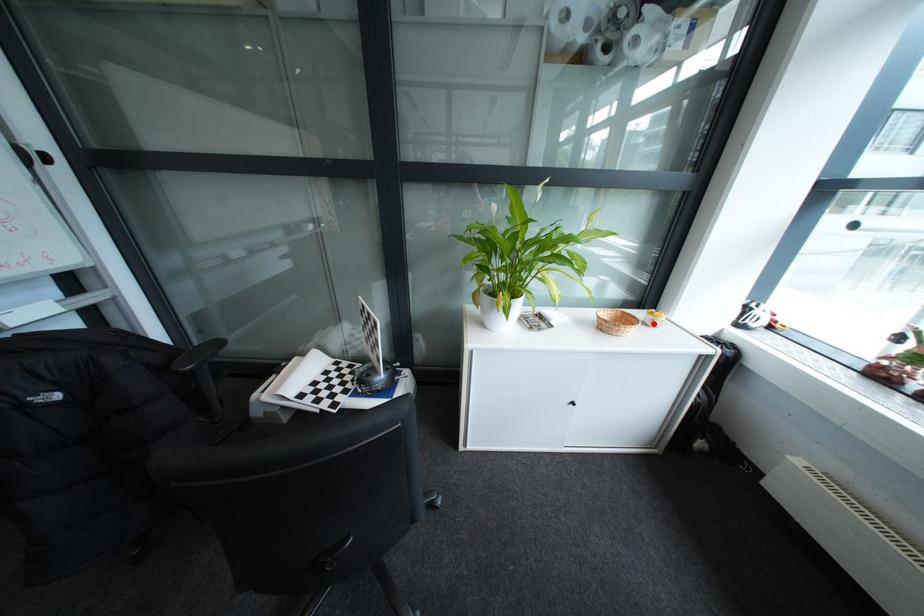
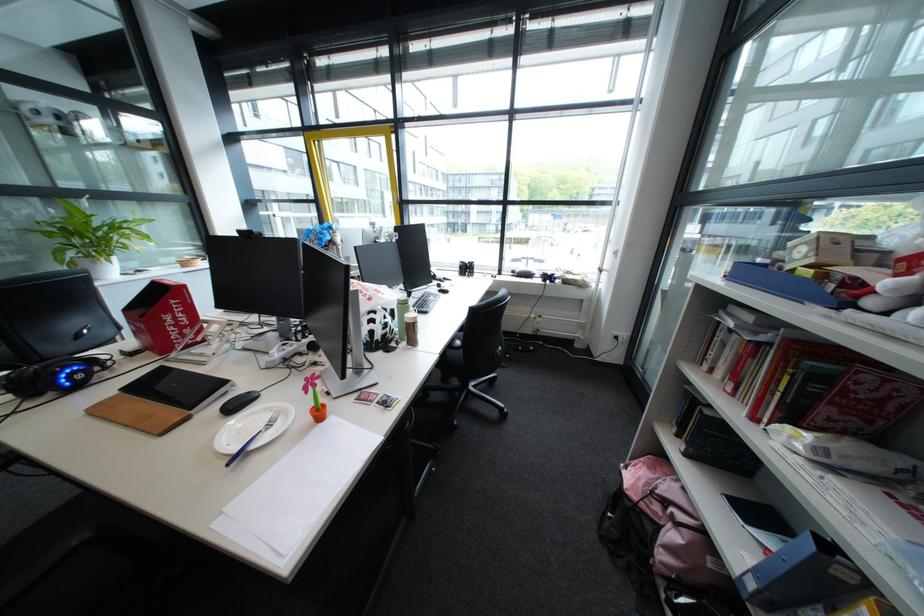
Question: I am providing you with two images of the same scene from different viewpoints. A red point is marked on the first image. Can you still see the location of the red point in image 2?

Choices:
 (A) Yes
 (B) No

Answer: (B)